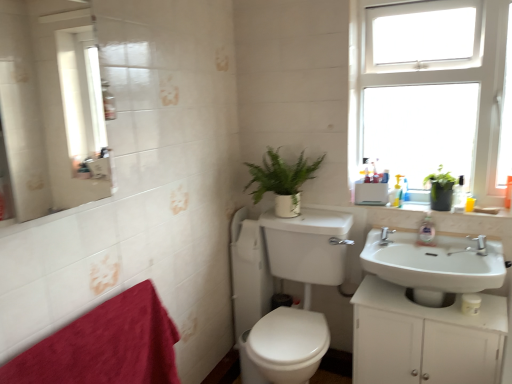
Identify the location of spots to the right of translucent plastic soap dispenser at upper right, which ranks as the second toiletry in front-to-back order. (421, 202).